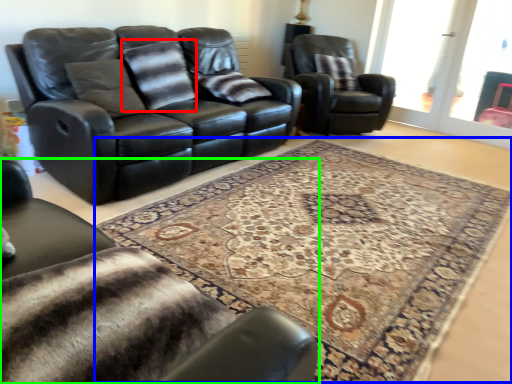
Question: Estimate the real-world distances between objects in this image. Which object is farther from pillow (highlighted by a red box), mat (highlighted by a blue box) or chair (highlighted by a green box)?

Choices:
 (A) mat
 (B) chair

Answer: (B)